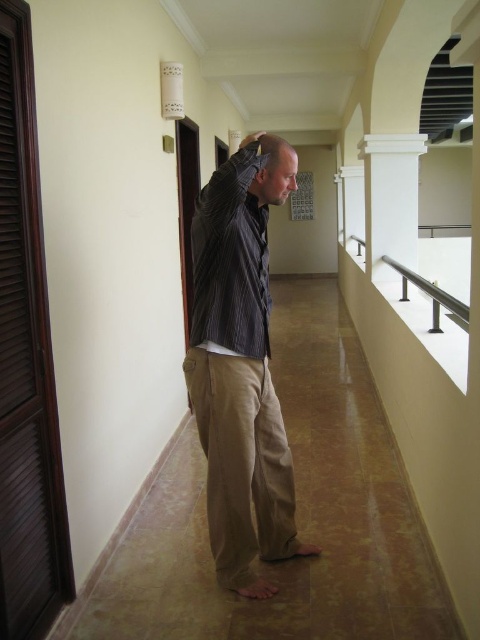
Question: From the image, what is the correct spatial relationship of striped fabric shirt at center in relation to satin silver railing at right?

Choices:
 (A) right
 (B) left

Answer: (B)

Question: Which object appears farthest from the camera in this image?

Choices:
 (A) light brown hair at center
 (B) white smooth column at upper right
 (C) striped fabric shirt at center
 (D) satin silver railing at right

Answer: (B)

Question: Considering the real-world distances, which object is farthest from the light brown hair at center?

Choices:
 (A) striped fabric shirt at center
 (B) white smooth column at upper right
 (C) satin silver railing at right

Answer: (B)

Question: Which of these objects is positioned farthest from the white smooth column at upper right?

Choices:
 (A) light brown hair at center
 (B) striped fabric shirt at center

Answer: (B)

Question: Does white smooth column at upper right have a lesser width compared to light brown hair at center?

Choices:
 (A) no
 (B) yes

Answer: (A)

Question: Does striped fabric shirt at center appear over satin silver railing at right?

Choices:
 (A) yes
 (B) no

Answer: (B)